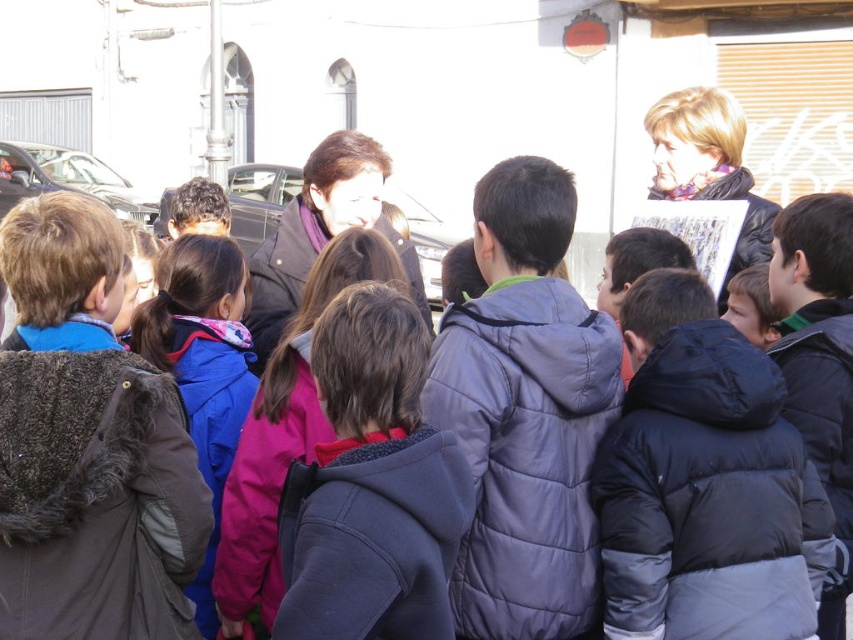
How distant is black puffy jacket at center from dark gray fleece jacket at center?

black puffy jacket at center and dark gray fleece jacket at center are 2.51 meters apart from each other.

Is black puffy jacket at center shorter than dark gray fleece jacket at center?

Yes, black puffy jacket at center is shorter than dark gray fleece jacket at center.

Does point (738, 419) lie in front of point (332, 324)?

Yes, point (738, 419) is closer to viewer.

Identify the location of black puffy jacket at center. The width and height of the screenshot is (853, 640). (704, 483).

Is point (679, 486) less distant than point (579, 497)?

Yes, point (679, 486) is closer to viewer.

Is point (697, 582) behind point (445, 410)?

No, (697, 582) is in front of (445, 410).

You are a GUI agent. You are given a task and a screenshot of the screen. Output one action in this format:
    pyautogui.click(x=<x>, y=<y>)
    Task: Click on the black puffy jacket at center
    The height and width of the screenshot is (640, 853).
    Given the screenshot: What is the action you would take?
    pyautogui.click(x=704, y=483)

Looking at this image, who is more distant from viewer, [538,390] or [334,321]?

Positioned behind is point [538,390].

Which is below, dark blue puffy jacket at center or dark gray fleece jacket at center?

dark gray fleece jacket at center is below.

Find the location of a particular element. The image size is (853, 640). dark blue puffy jacket at center is located at coordinates (525, 412).